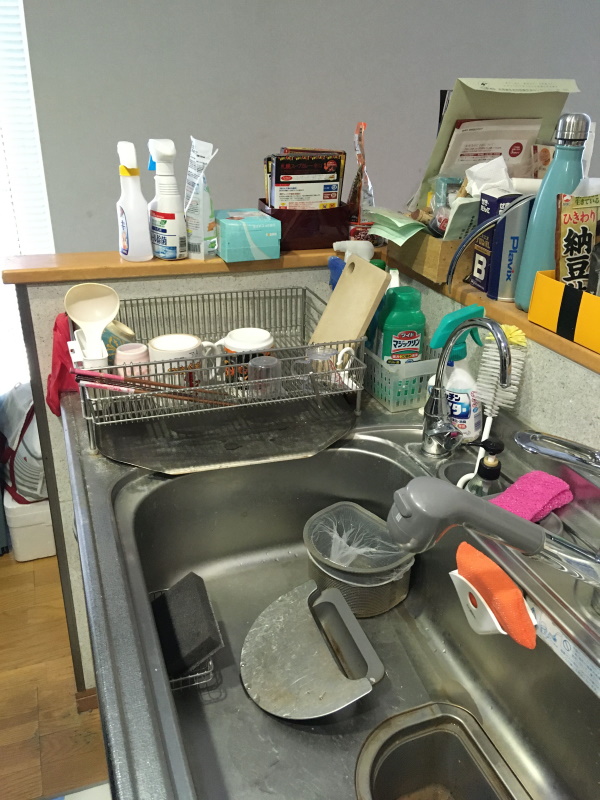
At what (x,y) coordinates should I click in order to perform the action: click on kitchen sink. Please return your answer as a coordinate pair (x, y). This screenshot has height=800, width=600. Looking at the image, I should click on (423, 650).